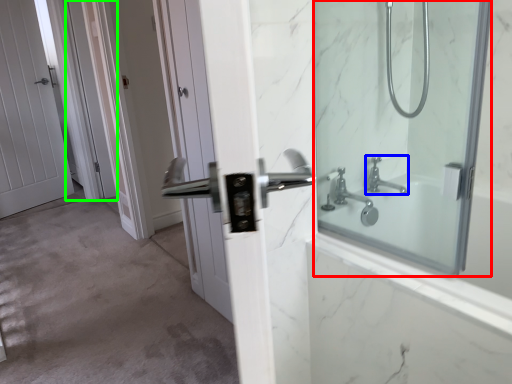
Question: Estimate the real-world distances between objects in this image. Which object is closer to mirror (highlighted by a red box), tap (highlighted by a blue box) or screen door (highlighted by a green box)?

Choices:
 (A) tap
 (B) screen door

Answer: (A)